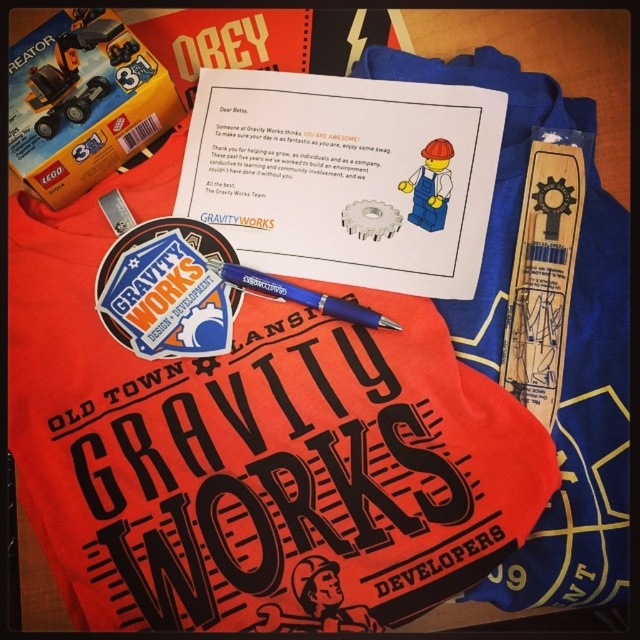
Between point (131, 260) and point (440, 205), which one is positioned behind?

The point (131, 260) is behind.

The height and width of the screenshot is (640, 640). In order to click on matte sticker at center in this screenshot , I will do `click(166, 291)`.

Who is higher up, matte black t-shirt at center or matte plastic minifigure at center?

matte plastic minifigure at center

Between matte black t-shirt at center and matte plastic minifigure at center, which one has more height?

matte black t-shirt at center

Between point (330, 628) and point (440, 161), which one is positioned in front?

Point (330, 628)

What are the coordinates of `matte black t-shirt at center` in the screenshot? It's located at (282, 483).

Can you confirm if matte black t-shirt at center is shorter than matte sticker at center?

No, matte black t-shirt at center is not shorter than matte sticker at center.

Can you confirm if matte black t-shirt at center is positioned to the right of matte sticker at center?

Correct, you'll find matte black t-shirt at center to the right of matte sticker at center.

At what (x,y) coordinates should I click in order to perform the action: click on matte black t-shirt at center. Please return your answer as a coordinate pair (x, y). Looking at the image, I should click on (282, 483).